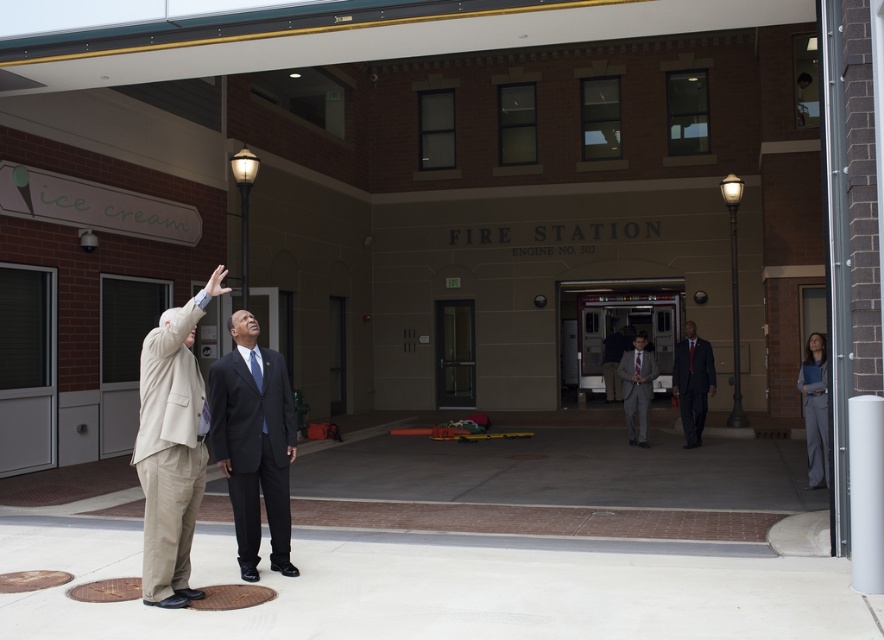
Question: Which object appears closest to the camera in this image?

Choices:
 (A) dark gray suit at center
 (B) black matte suit at center
 (C) beige fabric suit at lower left
 (D) gray suit at center

Answer: (C)

Question: Is beige fabric suit at lower left thinner than matte black suit at center?

Choices:
 (A) yes
 (B) no

Answer: (A)

Question: Does beige fabric suit at lower left have a larger size compared to dark gray suit at center?

Choices:
 (A) yes
 (B) no

Answer: (B)

Question: Among these points, which one is farthest from the camera?

Choices:
 (A) (183, 572)
 (B) (616, 362)

Answer: (B)

Question: Which is farther from the black matte suit at center?

Choices:
 (A) matte black suit at center
 (B) dark gray suit at center

Answer: (B)

Question: Does beige fabric suit at lower left have a larger size compared to black matte suit at center?

Choices:
 (A) no
 (B) yes

Answer: (B)